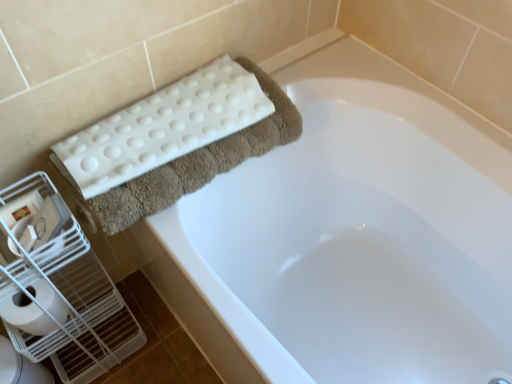
Question: Could you tell me if white plastic bird cage at left is facing white glossy toilet bowl at lower left?

Choices:
 (A) yes
 (B) no

Answer: (B)

Question: Considering the relative positions of white plastic bird cage at left and white glossy toilet bowl at lower left in the image provided, is white plastic bird cage at left in front of white glossy toilet bowl at lower left?

Choices:
 (A) no
 (B) yes

Answer: (B)

Question: Is white plastic bird cage at left turned away from white glossy toilet bowl at lower left?

Choices:
 (A) yes
 (B) no

Answer: (B)

Question: Is white plastic bird cage at left directly adjacent to white glossy toilet bowl at lower left?

Choices:
 (A) no
 (B) yes

Answer: (A)

Question: Considering the relative sizes of white plastic bird cage at left and white glossy toilet bowl at lower left in the image provided, is white plastic bird cage at left shorter than white glossy toilet bowl at lower left?

Choices:
 (A) yes
 (B) no

Answer: (B)

Question: Considering the relative sizes of white plastic bird cage at left and white glossy toilet bowl at lower left in the image provided, is white plastic bird cage at left bigger than white glossy toilet bowl at lower left?

Choices:
 (A) no
 (B) yes

Answer: (B)

Question: Considering the relative sizes of white glossy toilet bowl at lower left and white textured bath towel at upper left in the image provided, is white glossy toilet bowl at lower left shorter than white textured bath towel at upper left?

Choices:
 (A) no
 (B) yes

Answer: (A)

Question: Does white glossy toilet bowl at lower left have a greater height compared to white textured bath towel at upper left?

Choices:
 (A) yes
 (B) no

Answer: (A)

Question: From a real-world perspective, does white glossy toilet bowl at lower left stand above white textured bath towel at upper left?

Choices:
 (A) yes
 (B) no

Answer: (B)

Question: Is white glossy toilet bowl at lower left in front of white textured bath towel at upper left?

Choices:
 (A) no
 (B) yes

Answer: (A)

Question: From a real-world perspective, is white glossy toilet bowl at lower left positioned under white textured bath towel at upper left based on gravity?

Choices:
 (A) yes
 (B) no

Answer: (A)

Question: Would you say white textured bath towel at upper left is part of white glossy toilet bowl at lower left's contents?

Choices:
 (A) no
 (B) yes

Answer: (A)

Question: Could white plastic bird cage at left be considered to be inside white glossy toilet bowl at lower left?

Choices:
 (A) no
 (B) yes

Answer: (A)